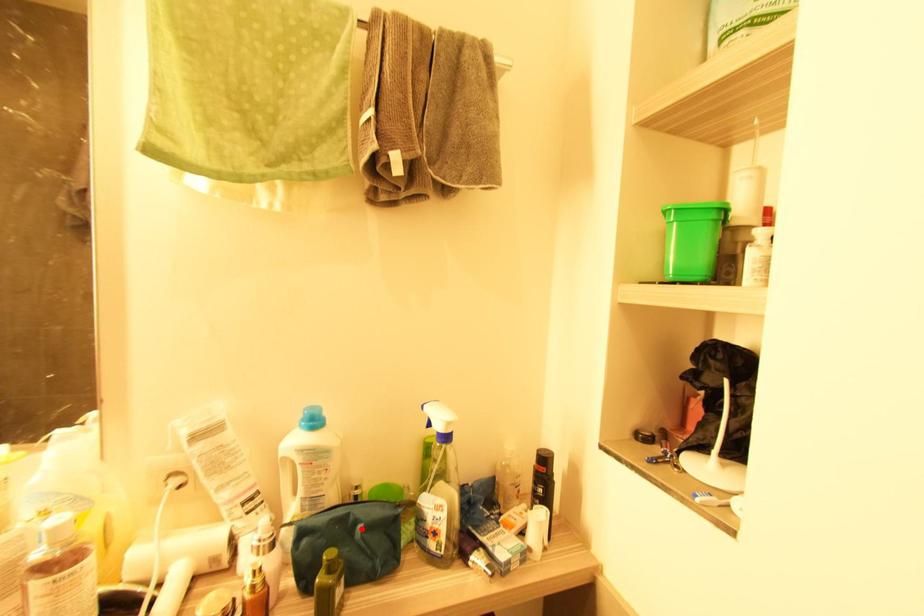
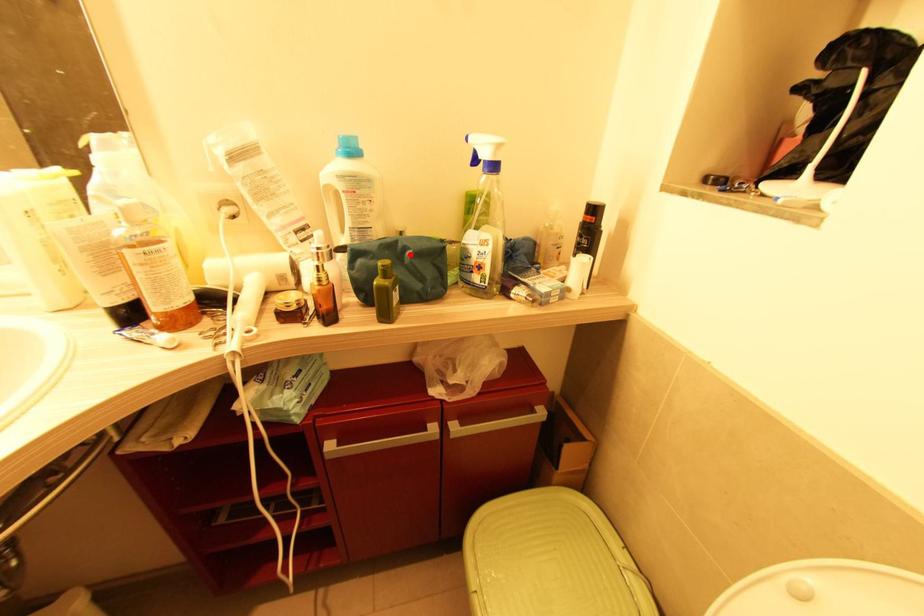
I am providing you with two images of the same scene from different viewpoints. A red point is marked on the first image and another point is marked on the second image. Is the marked point in image1 the same physical position as the marked point in image2?

Yes